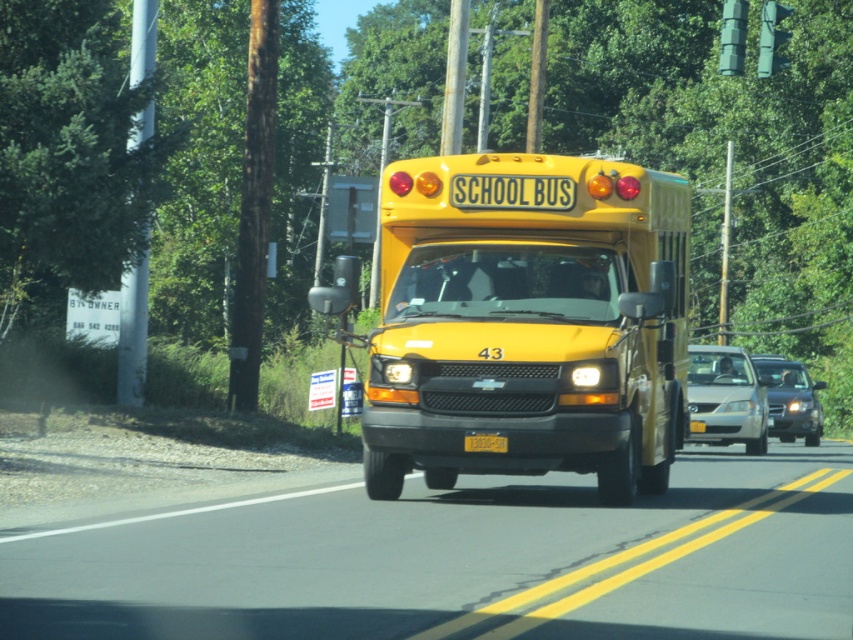
Between silver metallic sedan at center and shiny black sedan at center, which one has more height?

With more height is silver metallic sedan at center.

Does silver metallic sedan at center have a smaller size compared to shiny black sedan at center?

Indeed, silver metallic sedan at center has a smaller size compared to shiny black sedan at center.

Measure the distance between silver metallic sedan at center and camera.

silver metallic sedan at center and camera are 21.83 meters apart.

The image size is (853, 640). What are the coordinates of `silver metallic sedan at center` in the screenshot? It's located at (724, 397).

The image size is (853, 640). Describe the element at coordinates (527, 321) in the screenshot. I see `yellow matte school bus at center` at that location.

Is yellow matte school bus at center below silver metallic sedan at center?

No.

Who is more distant from viewer, (x=672, y=292) or (x=703, y=396)?

Point (x=703, y=396)

Where is `yellow matte school bus at center`? Image resolution: width=853 pixels, height=640 pixels. yellow matte school bus at center is located at coordinates (527, 321).

Does shiny black sedan at center have a smaller size compared to yellow matte license plate at center?

Actually, shiny black sedan at center might be larger than yellow matte license plate at center.

You are a GUI agent. You are given a task and a screenshot of the screen. Output one action in this format:
    pyautogui.click(x=<x>, y=<y>)
    Task: Click on the shiny black sedan at center
    The height and width of the screenshot is (640, 853).
    Given the screenshot: What is the action you would take?
    pyautogui.click(x=790, y=400)